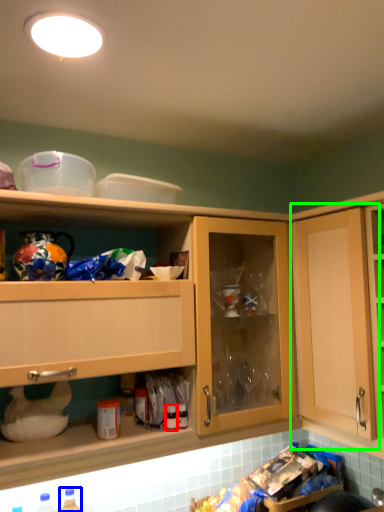
Question: Which object is positioned farthest from bottle (highlighted by a red box)? Select from bottle (highlighted by a blue box) and cabinetry (highlighted by a green box).

Choices:
 (A) bottle
 (B) cabinetry

Answer: (B)